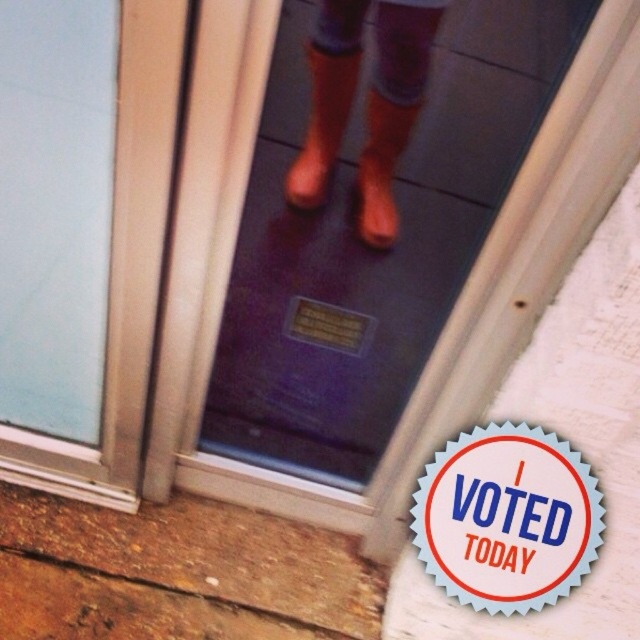
Question: Is transparent plastic screen door at center thinner than orange rubber boots at center?

Choices:
 (A) yes
 (B) no

Answer: (B)

Question: Which of the following is the closest to the observer?

Choices:
 (A) (x=324, y=67)
 (B) (x=310, y=337)
 (C) (x=317, y=52)

Answer: (C)

Question: Which point is closer to the camera?

Choices:
 (A) (481, 554)
 (B) (369, 166)
 (C) (451, 216)

Answer: (B)

Question: Which object is closer to the camera taking this photo?

Choices:
 (A) brown leather boot at center
 (B) transparent plastic screen door at center
 (C) orange rubber boots at center

Answer: (B)

Question: Is transparent plastic screen door at center to the left of orange rubber boots at center from the viewer's perspective?

Choices:
 (A) no
 (B) yes

Answer: (B)

Question: Does blue paper sticker at center have a smaller size compared to orange rubber boots at center?

Choices:
 (A) yes
 (B) no

Answer: (B)